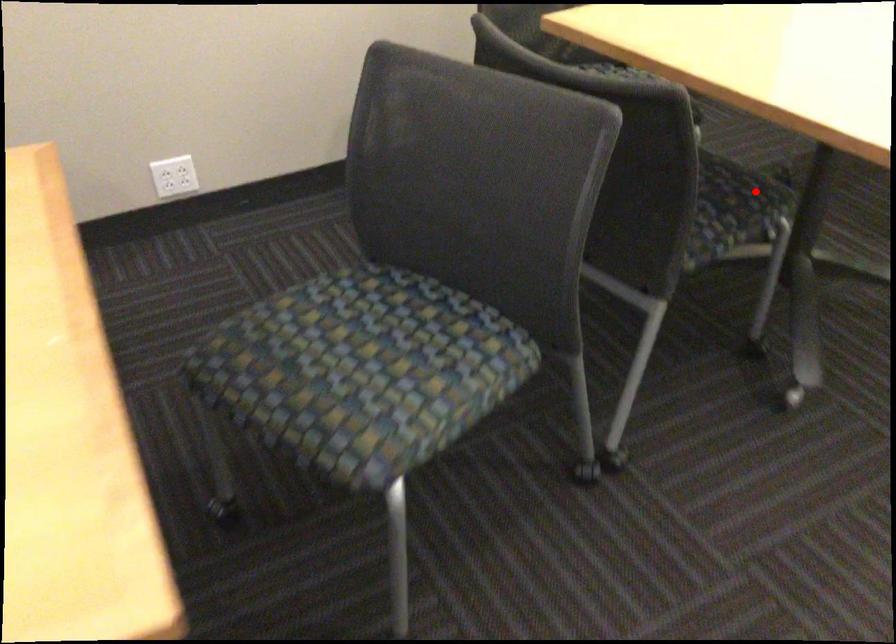
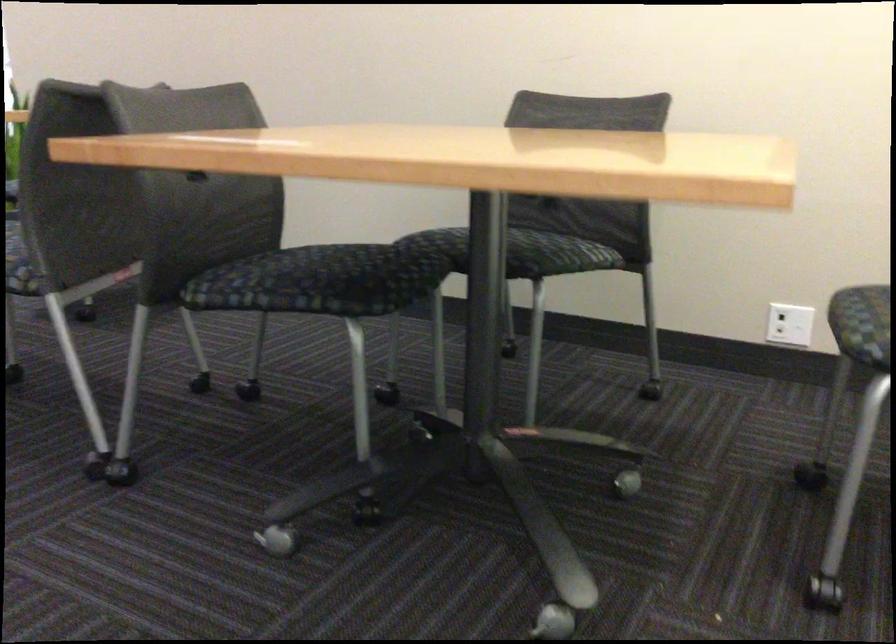
Where in the second image is the point corresponding to the highlighted location from the first image?

(320, 281)